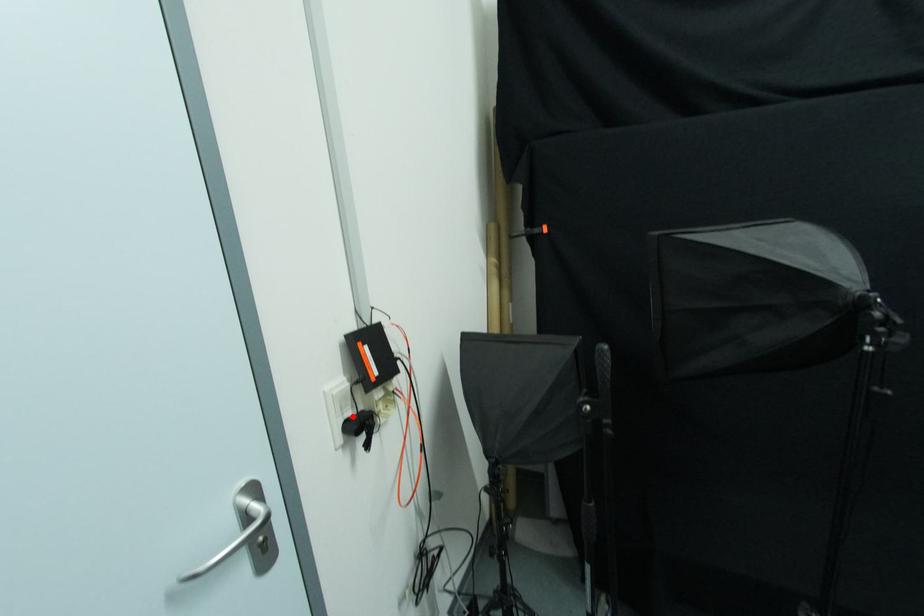
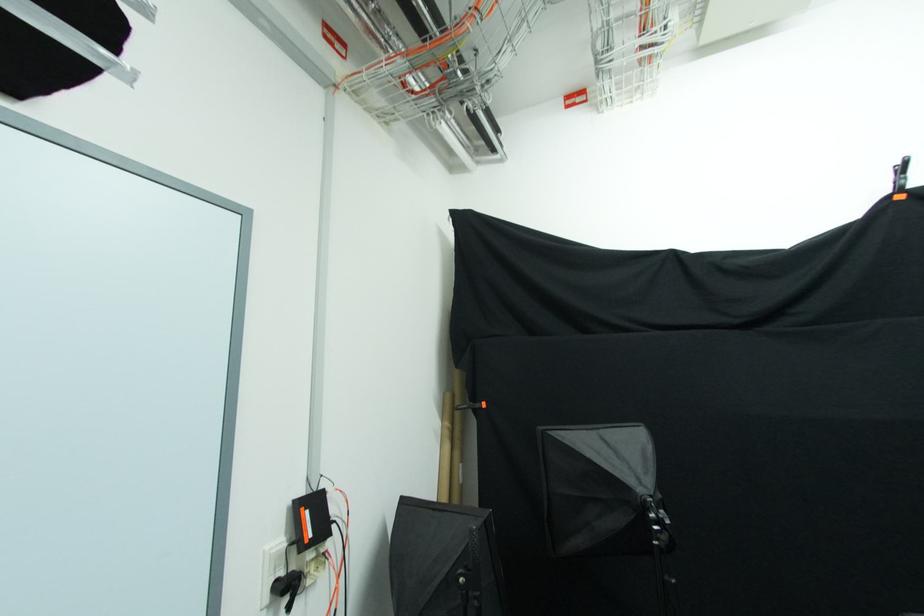
The point at the highlighted location is marked in the first image. Where is the corresponding point in the second image?

(285, 577)